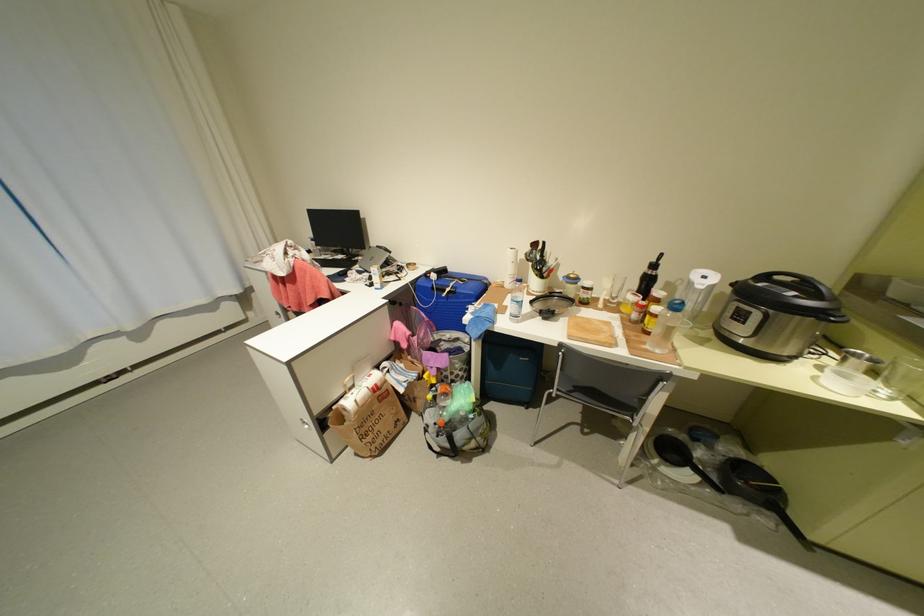
The location [650,317] corresponds to which object?

It corresponds to the bottle with yellow lid in the image.